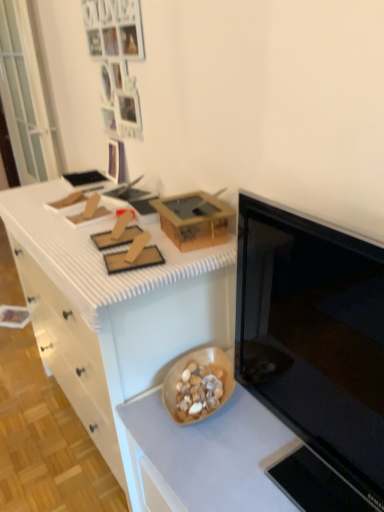
This screenshot has height=512, width=384. Find the location of `free spot above wooden bowl at lower center, which is the 2th countertop from top to bottom (from a real-world perspective)`. free spot above wooden bowl at lower center, which is the 2th countertop from top to bottom (from a real-world perspective) is located at coordinates (231, 450).